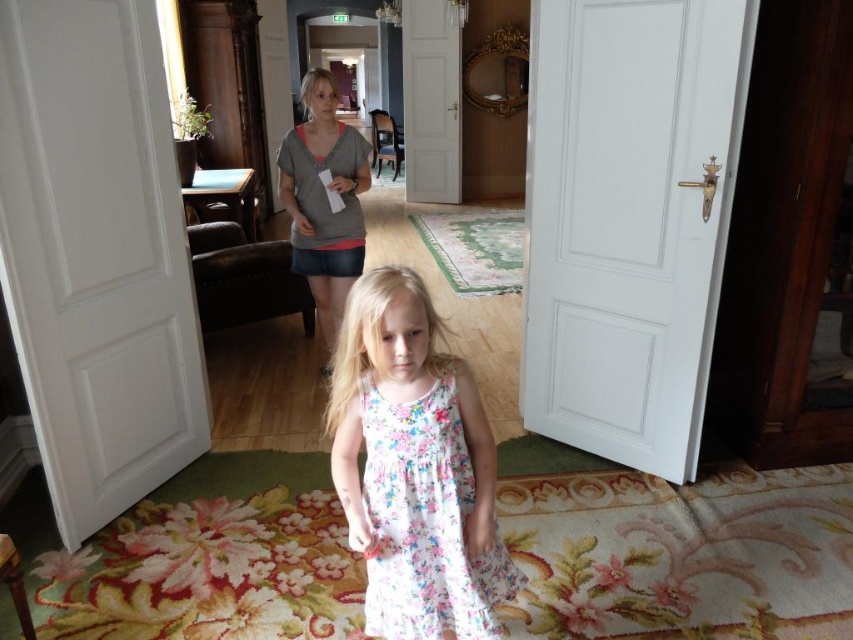
You are a fashion designer observing two garments in the image. The first is the floral cotton dress at center, and the second is the gray cotton shirt at upper center. Which garment has a larger size?

The gray cotton shirt at upper center is larger than the floral cotton dress at center.

You are standing in the elegant interior space and want to walk towards the two points marked in the image. Which point, point (448,436) or point (305,93), would you reach first?

You would reach point (448,436) first because it is closer to you than point (305,93).

You are a fashion designer observing two garments in the image. The first is the floral cotton dress at center and the second is the gray cotton shirt at upper center. Which garment has a shorter length?

The floral cotton dress at center is shorter than the gray cotton shirt at upper center.